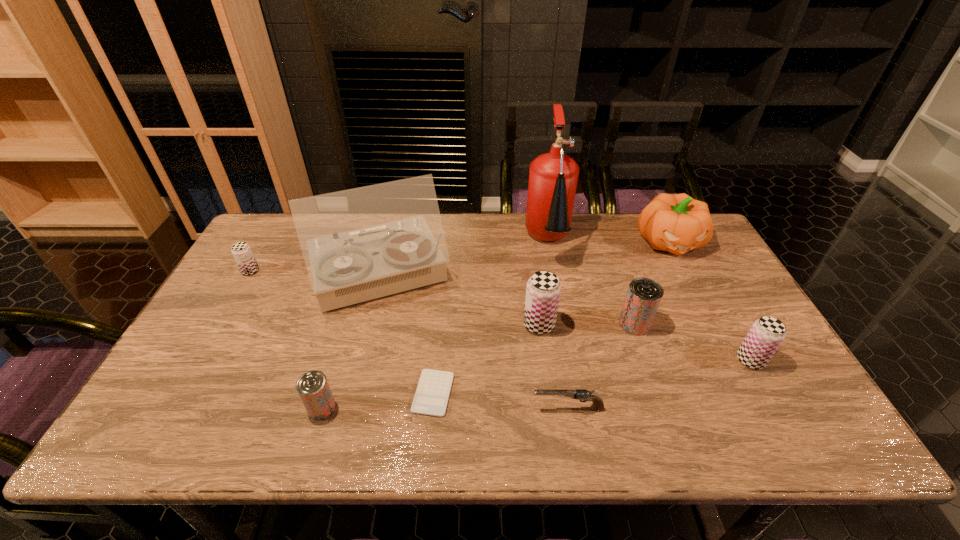
Identify the location of vacant point at the far edge. (495, 219).

Locate an element on the screen. blank space at the near edge of the desktop is located at coordinates (628, 420).

Locate an element on the screen. free space at the left edge of the desktop is located at coordinates (213, 303).

Locate an element on the screen. free space at the right edge of the desktop is located at coordinates (725, 364).

Find the location of `vacant space at the far left corner of the desktop`. vacant space at the far left corner of the desktop is located at coordinates (267, 224).

Locate an element on the screen. Image resolution: width=960 pixels, height=540 pixels. free spot between the white record player and the fourth farthest beer can is located at coordinates (565, 318).

Locate an element on the screen. The width and height of the screenshot is (960, 540). vacant area between the nearest beer can and the calculator is located at coordinates (377, 401).

Where is `empty location between the farther red beer can and the gun`? Image resolution: width=960 pixels, height=540 pixels. empty location between the farther red beer can and the gun is located at coordinates (601, 366).

The image size is (960, 540). I want to click on vacant space that's between the white record player and the fire extinguisher, so click(x=465, y=259).

You are a GUI agent. You are given a task and a screenshot of the screen. Output one action in this format:
    pyautogui.click(x=<x>, y=<y>)
    Task: Click on the free space between the calculator and the farther red beer can
    Image resolution: width=960 pixels, height=540 pixels.
    Given the screenshot: What is the action you would take?
    pyautogui.click(x=534, y=359)